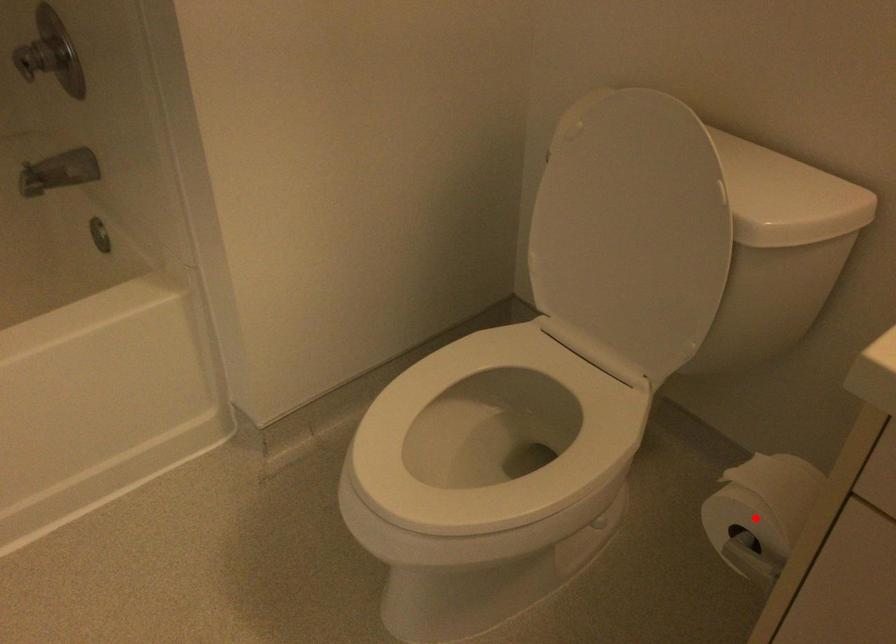
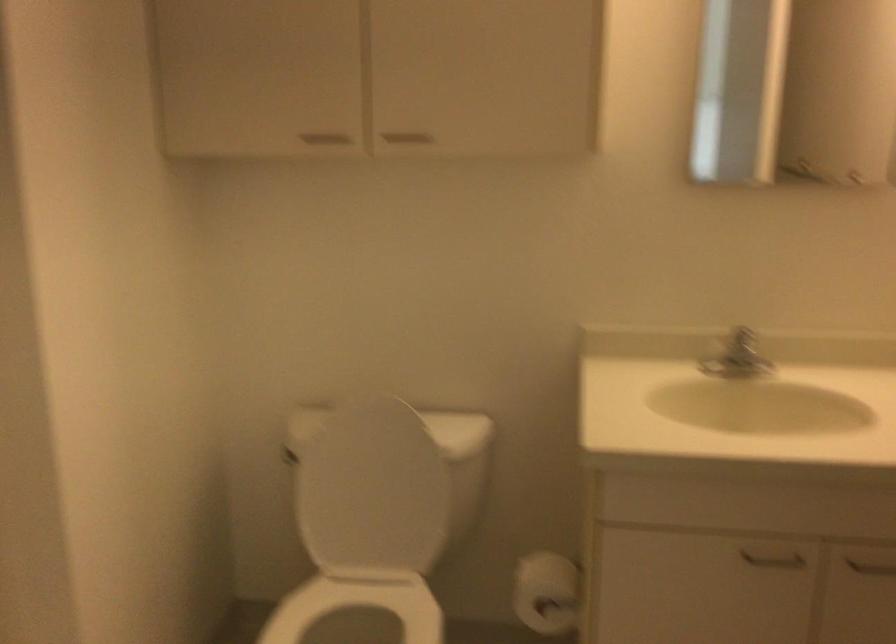
Question: I am providing you with two images of the same scene from different viewpoints. In image1, a red point is highlighted. Considering the same 3D point in image2, which of the following is correct?

Choices:
 (A) It is closer
 (B) It is farther

Answer: (B)